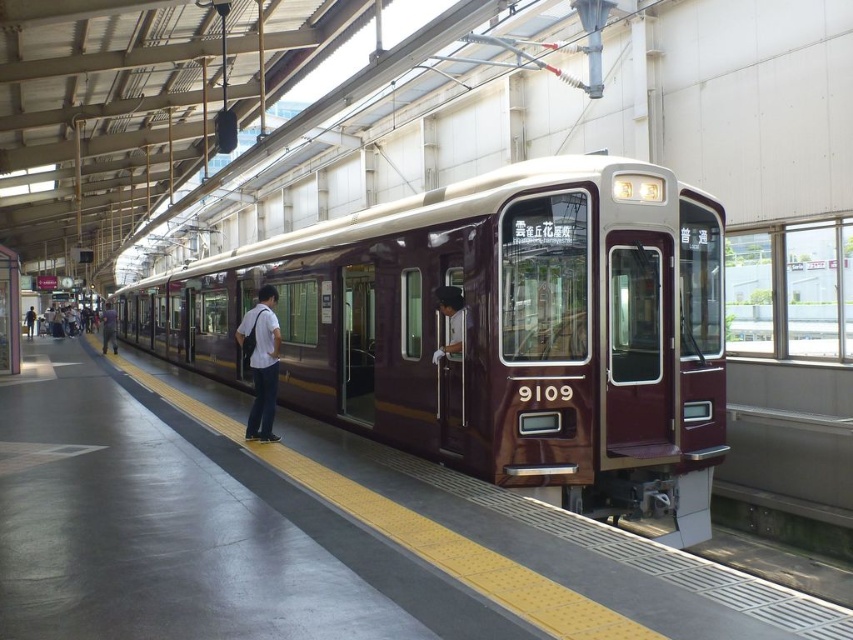
Question: Is matte purple train door at center to the left of denim jacket at center from the viewer's perspective?

Choices:
 (A) no
 (B) yes

Answer: (A)

Question: Which of the following is the closest to the observer?

Choices:
 (A) shiny maroon train at center
 (B) white shirt at center
 (C) denim jacket at center
 (D) dark purple fabric pants at center

Answer: (A)

Question: Estimate the real-world distances between objects in this image. Which object is farther from the shiny maroon train at center?

Choices:
 (A) dark purple fabric pants at center
 (B) matte purple train door at center
 (C) denim jacket at center
 (D) white shirt at center

Answer: (C)

Question: Does shiny maroon train at center lie in front of denim jacket at center?

Choices:
 (A) yes
 (B) no

Answer: (A)

Question: Is white shirt at center thinner than denim jacket at center?

Choices:
 (A) no
 (B) yes

Answer: (B)

Question: Which object is farther from the camera taking this photo?

Choices:
 (A) dark purple fabric pants at center
 (B) denim jacket at center
 (C) white shirt at center

Answer: (B)